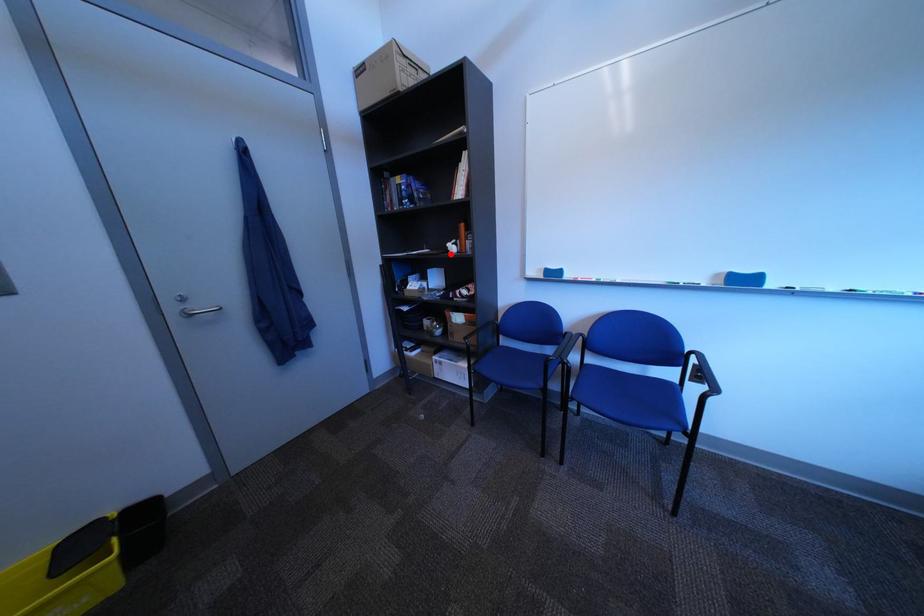
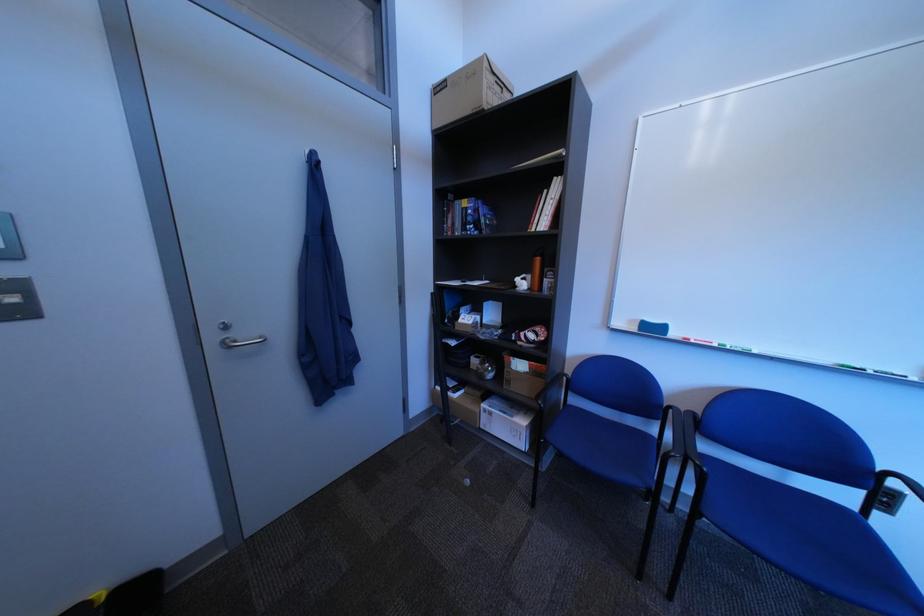
In the second image, find the point that corresponds to the highlighted location in the first image.

(517, 290)